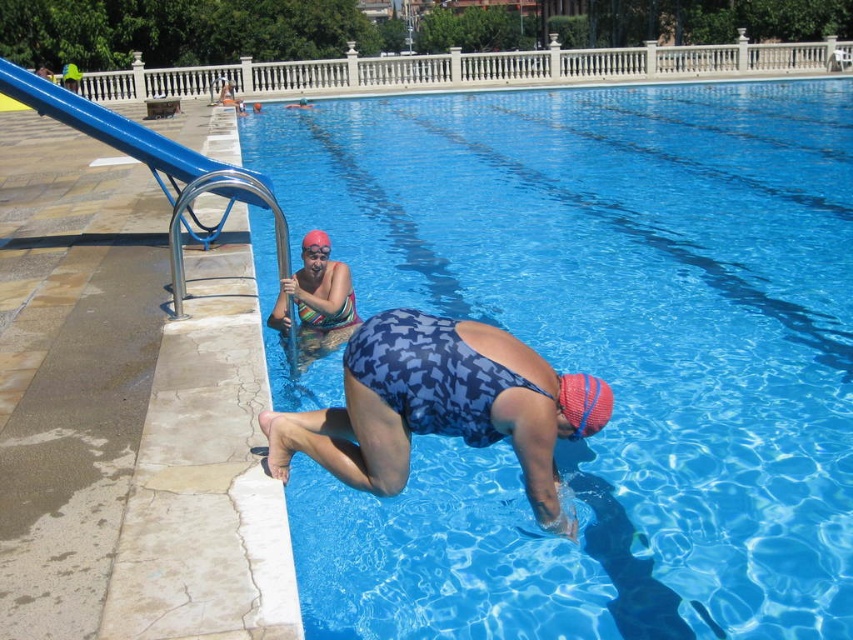
Question: Is transparent blue water at center below blue printed swimsuit at center?

Choices:
 (A) yes
 (B) no

Answer: (B)

Question: Which of the following is the farthest from the observer?

Choices:
 (A) (318, 324)
 (B) (590, 406)
 (C) (556, 529)
 (D) (647, 304)

Answer: (D)

Question: Does multicolored swimsuit at center appear over red matte swim cap at upper center?

Choices:
 (A) no
 (B) yes

Answer: (A)

Question: Among these objects, which one is nearest to the camera?

Choices:
 (A) blue printed swimsuit at center
 (B) red matte swim cap at upper center

Answer: (A)

Question: Can you confirm if multicolored swimsuit at center is positioned to the right of red mesh swim cap at lower center?

Choices:
 (A) no
 (B) yes

Answer: (A)

Question: Which point is farther from the camera taking this photo?

Choices:
 (A) (325, 340)
 (B) (583, 388)
 (C) (306, 248)
 (D) (657, 392)

Answer: (A)